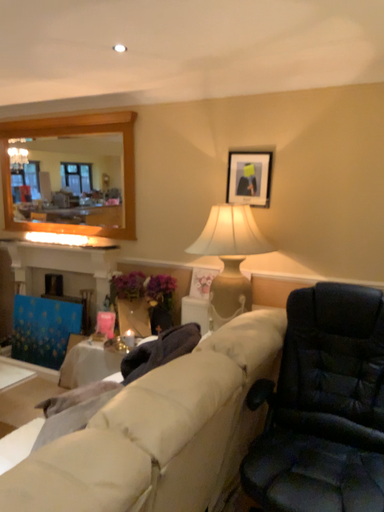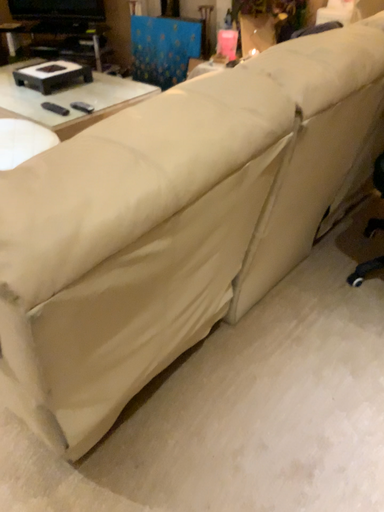
Question: How did the camera likely rotate when shooting the video?

Choices:
 (A) rotated upward
 (B) rotated downward

Answer: (B)